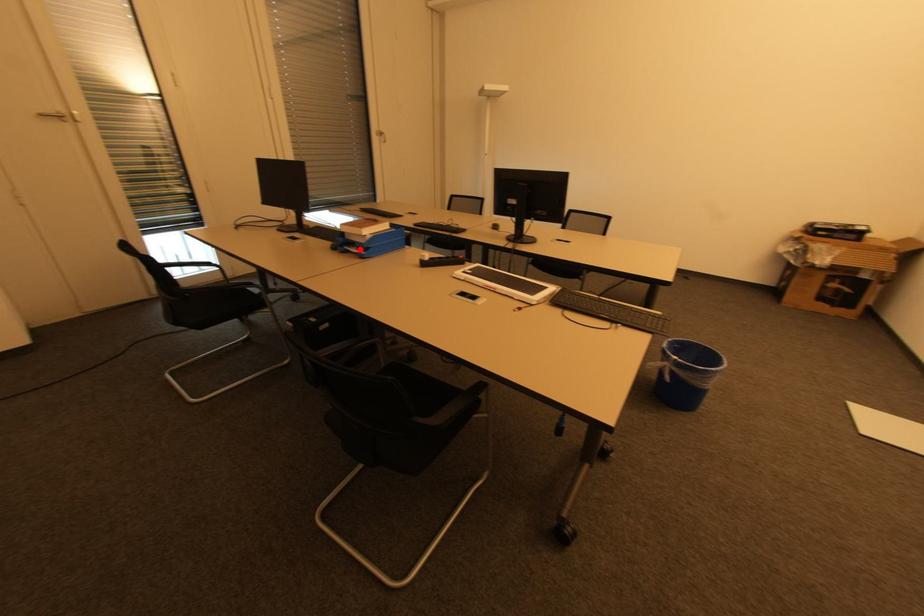
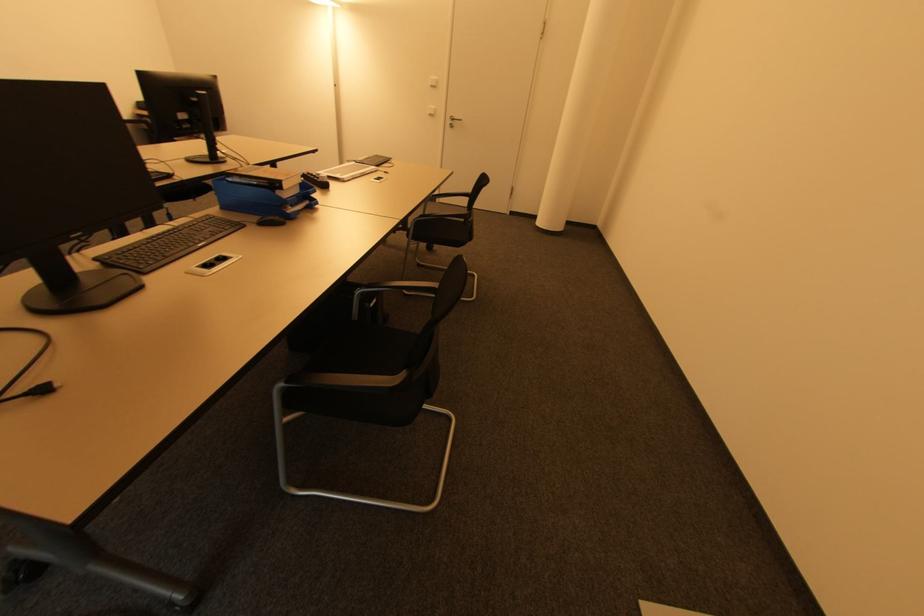
Find the pixel in the second image that matches the highlighted location in the first image.

(294, 207)